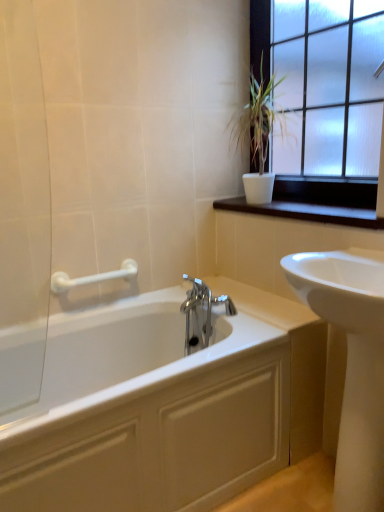
Question: Is white ceramic plant at upper right bigger or smaller than white glossy sink at right?

Choices:
 (A) small
 (B) big

Answer: (A)

Question: Is point (268, 144) closer or farther from the camera than point (344, 314)?

Choices:
 (A) closer
 (B) farther

Answer: (B)

Question: Based on their relative distances, which object is farther from the white glossy bathtub at center?

Choices:
 (A) white ceramic plant at upper right
 (B) dark wood window sill at upper right
 (C) white glossy sink at right
 (D) frosted glass window at upper right
 (E) white plastic grab bar at upper left

Answer: (D)

Question: Which object is the farthest from the frosted glass window at upper right?

Choices:
 (A) white glossy bathtub at center
 (B) dark wood window sill at upper right
 (C) white glossy sink at right
 (D) white plastic grab bar at upper left
 (E) white ceramic plant at upper right

Answer: (A)